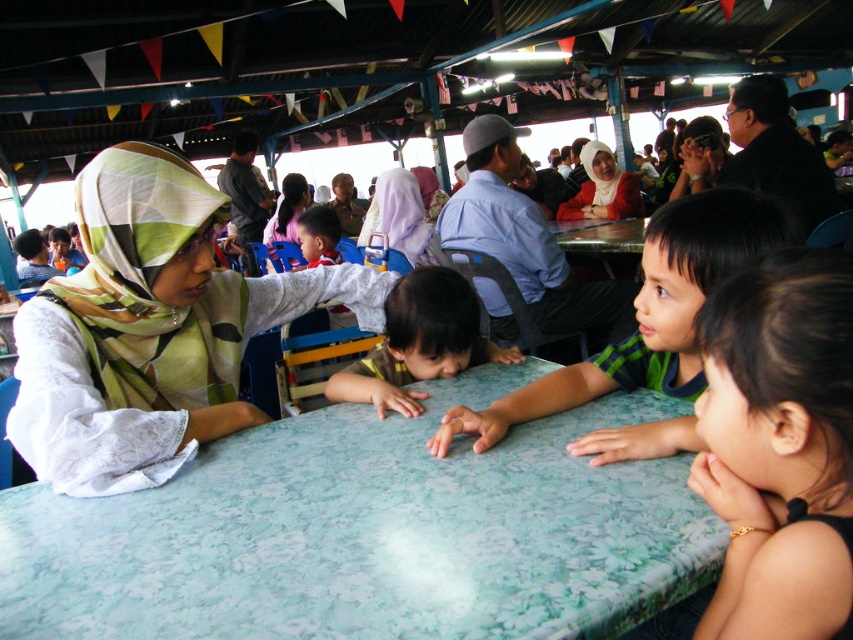
Does green floral tablecloth at center appear on the left side of dark brown hair at lower right?

Yes, green floral tablecloth at center is to the left of dark brown hair at lower right.

In the scene shown: Is green floral tablecloth at center thinner than dark brown hair at lower right?

No.

Is point (688, 531) positioned before point (770, 305)?

No, it is behind (770, 305).

This screenshot has width=853, height=640. I want to click on green floral tablecloth at center, so click(370, 532).

Between green textured shirt at center and light purple fabric headscarf at center, which one is positioned lower?

green textured shirt at center

Which is behind, point (633, 445) or point (405, 188)?

The point (405, 188) is behind.

Locate an element on the screen. green textured shirt at center is located at coordinates (647, 314).

Can you confirm if green floral tablecloth at center is positioned above green textured shirt at center?

No.

Is green floral tablecloth at center smaller than green textured shirt at center?

No, green floral tablecloth at center is not smaller than green textured shirt at center.

Is point (436, 508) closer to viewer compared to point (746, 260)?

Yes, point (436, 508) is closer to viewer.

Where is `green floral tablecloth at center`? This screenshot has height=640, width=853. green floral tablecloth at center is located at coordinates (370, 532).